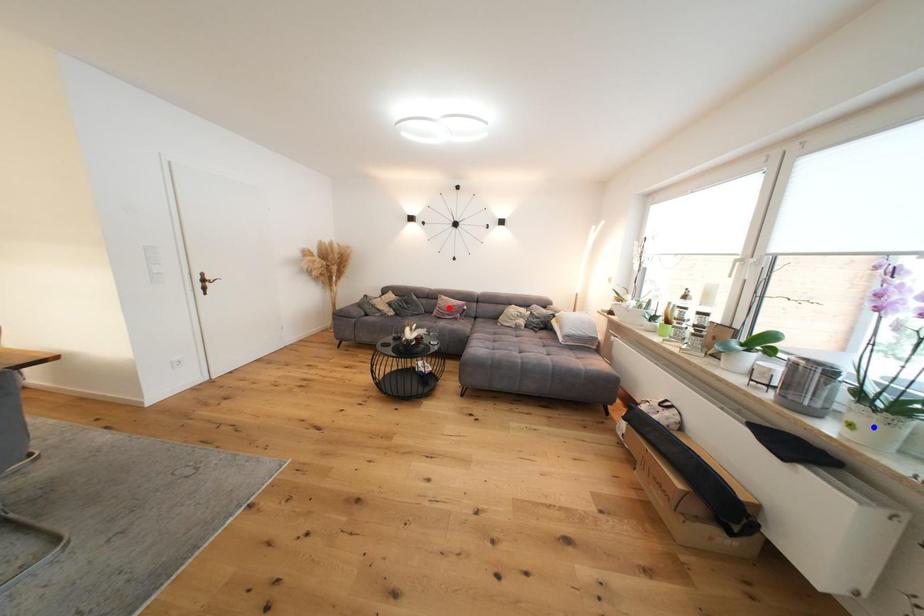
Question: Two points are marked on the image. Which point is closer to the camera?

Choices:
 (A) Blue point is closer.
 (B) Red point is closer.

Answer: (A)